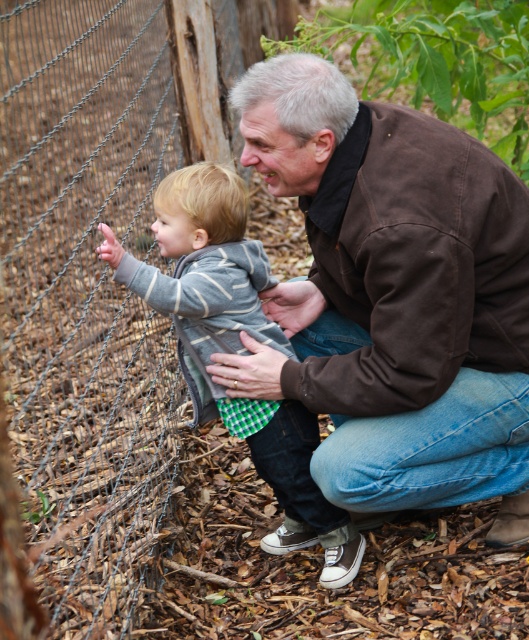
Is brown leather jacket at center below striped cotton sweater at center?

Incorrect, brown leather jacket at center is not positioned below striped cotton sweater at center.

How much distance is there between brown leather jacket at center and striped cotton sweater at center?

They are 13.33 inches apart.

Is point (446, 253) in front of point (279, 545)?

Yes, it is.

Locate an element on the screen. brown leather jacket at center is located at coordinates (394, 296).

Between brown leather jacket at center and wire mesh fence at left, which one appears on the left side from the viewer's perspective?

Positioned to the left is wire mesh fence at left.

Find the location of a particular element. The image size is (529, 640). brown leather jacket at center is located at coordinates (394, 296).

Is wire mesh fence at left shorter than striped cotton sweater at center?

Yes, wire mesh fence at left is shorter than striped cotton sweater at center.

This screenshot has width=529, height=640. Describe the element at coordinates (86, 300) in the screenshot. I see `wire mesh fence at left` at that location.

Find the location of `wire mesh fence at left`. wire mesh fence at left is located at coordinates (86, 300).